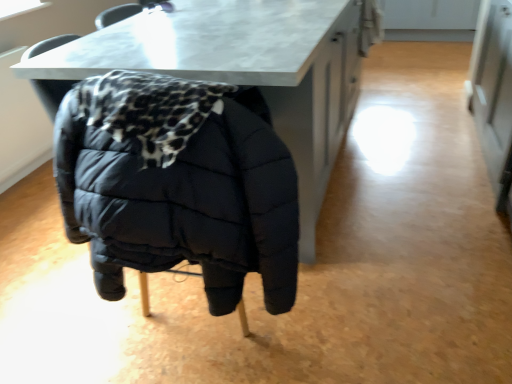
Question: Is matte black puffer jacket at center directly adjacent to matte white marble table at center?

Choices:
 (A) yes
 (B) no

Answer: (B)

Question: Does matte black puffer jacket at center come behind matte white marble table at center?

Choices:
 (A) no
 (B) yes

Answer: (A)

Question: Considering the relative sizes of matte black puffer jacket at center and matte white marble table at center in the image provided, is matte black puffer jacket at center taller than matte white marble table at center?

Choices:
 (A) no
 (B) yes

Answer: (B)

Question: From a real-world perspective, is matte black puffer jacket at center located beneath matte white marble table at center?

Choices:
 (A) no
 (B) yes

Answer: (A)

Question: Can you confirm if matte black puffer jacket at center is smaller than matte white marble table at center?

Choices:
 (A) no
 (B) yes

Answer: (B)

Question: Considering the relative sizes of matte black puffer jacket at center and matte white marble table at center in the image provided, is matte black puffer jacket at center wider than matte white marble table at center?

Choices:
 (A) no
 (B) yes

Answer: (A)

Question: Is matte white marble table at center positioned behind matte black puffer jacket at center?

Choices:
 (A) no
 (B) yes

Answer: (B)

Question: Does matte white marble table at center have a lesser width compared to matte black puffer jacket at center?

Choices:
 (A) yes
 (B) no

Answer: (B)

Question: Is there a large distance between matte white marble table at center and matte black puffer jacket at center?

Choices:
 (A) no
 (B) yes

Answer: (A)

Question: Is matte white marble table at center at the left side of matte black puffer jacket at center?

Choices:
 (A) yes
 (B) no

Answer: (B)

Question: From the image's perspective, does matte white marble table at center appear higher than matte black puffer jacket at center?

Choices:
 (A) yes
 (B) no

Answer: (A)

Question: Considering the relative sizes of matte white marble table at center and matte black puffer jacket at center in the image provided, is matte white marble table at center taller than matte black puffer jacket at center?

Choices:
 (A) yes
 (B) no

Answer: (B)

Question: Which is correct: matte black puffer jacket at center is inside matte white marble table at center, or outside of it?

Choices:
 (A) inside
 (B) outside

Answer: (A)